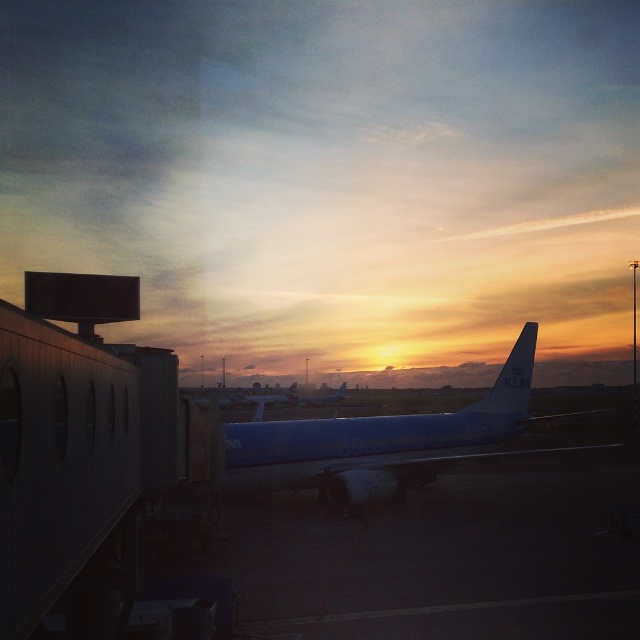
Question: Does blue glossy airplane at center have a smaller size compared to blue polished airplane at center?

Choices:
 (A) yes
 (B) no

Answer: (B)

Question: Which point is closer to the camera taking this photo?

Choices:
 (A) pos(310,400)
 (B) pos(253,442)

Answer: (B)

Question: Can you confirm if blue matte airplane at center is bigger than blue polished airplane at center?

Choices:
 (A) yes
 (B) no

Answer: (A)

Question: Which object appears farthest from the camera in this image?

Choices:
 (A) blue matte airplane at center
 (B) blue glossy airplane at center
 (C) blue polished airplane at center

Answer: (C)

Question: Which point is farther to the camera?

Choices:
 (A) blue polished airplane at center
 (B) blue glossy airplane at center
 (C) blue matte airplane at center

Answer: (A)

Question: Is blue glossy airplane at center wider than blue polished airplane at center?

Choices:
 (A) no
 (B) yes

Answer: (B)